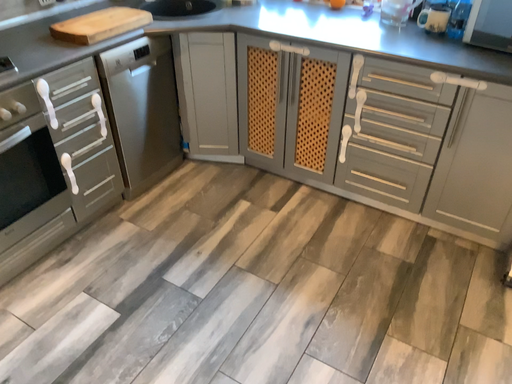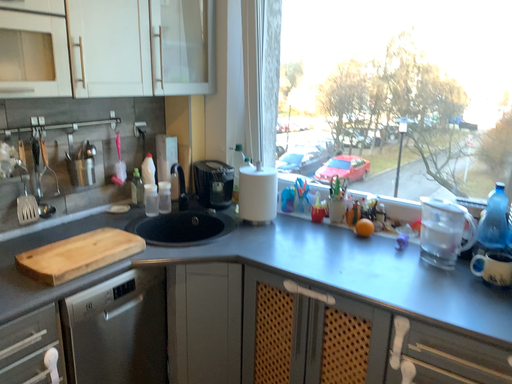
Question: How did the camera likely rotate when shooting the video?

Choices:
 (A) rotated downward
 (B) rotated upward

Answer: (B)